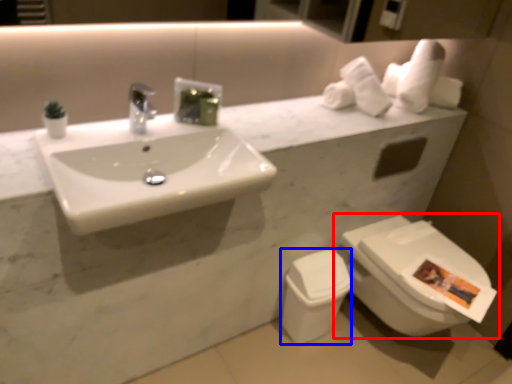
Question: Which point is closer to the camera, toilet (highlighted by a red box) or toilet bowl (highlighted by a blue box)?

Choices:
 (A) toilet
 (B) toilet bowl

Answer: (A)